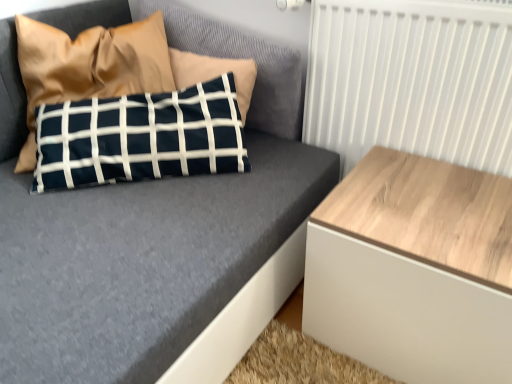
Question: Considering the relative sizes of navy blue fabric pillow at upper left and white wood radiator at upper right in the image provided, is navy blue fabric pillow at upper left smaller than white wood radiator at upper right?

Choices:
 (A) no
 (B) yes

Answer: (A)

Question: From the image's perspective, is navy blue fabric pillow at upper left located above white wood radiator at upper right?

Choices:
 (A) no
 (B) yes

Answer: (B)

Question: Considering the relative sizes of navy blue fabric pillow at upper left and white wood radiator at upper right in the image provided, is navy blue fabric pillow at upper left taller than white wood radiator at upper right?

Choices:
 (A) no
 (B) yes

Answer: (A)

Question: Is navy blue fabric pillow at upper left wider than white wood radiator at upper right?

Choices:
 (A) yes
 (B) no

Answer: (A)

Question: Is navy blue fabric pillow at upper left oriented away from white wood radiator at upper right?

Choices:
 (A) no
 (B) yes

Answer: (A)

Question: Is navy blue fabric pillow at upper left positioned behind white wood radiator at upper right?

Choices:
 (A) yes
 (B) no

Answer: (A)

Question: Can you confirm if navy blue fabric pillow at upper left is taller than light wood/texture side table at right?

Choices:
 (A) yes
 (B) no

Answer: (A)

Question: Is navy blue fabric pillow at upper left turned away from light wood/texture side table at right?

Choices:
 (A) yes
 (B) no

Answer: (B)

Question: Does navy blue fabric pillow at upper left have a larger size compared to light wood/texture side table at right?

Choices:
 (A) no
 (B) yes

Answer: (B)

Question: Is the depth of navy blue fabric pillow at upper left less than that of light wood/texture side table at right?

Choices:
 (A) no
 (B) yes

Answer: (A)

Question: Is the depth of navy blue fabric pillow at upper left greater than that of light wood/texture side table at right?

Choices:
 (A) no
 (B) yes

Answer: (B)

Question: Is light wood/texture side table at right completely or partially inside navy blue fabric pillow at upper left?

Choices:
 (A) no
 (B) yes

Answer: (A)

Question: Can you confirm if white wood radiator at upper right is wider than navy blue fabric pillow at upper left?

Choices:
 (A) no
 (B) yes

Answer: (A)